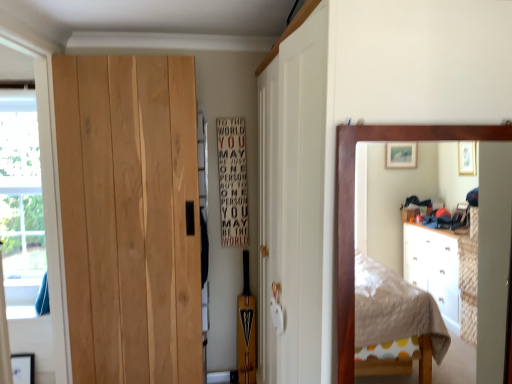
Question: Would you say natural wood door at left is to the left or to the right of transparent plastic window screen at left in the picture?

Choices:
 (A) right
 (B) left

Answer: (A)

Question: Looking at the image, does natural wood door at left seem bigger or smaller compared to transparent plastic window screen at left?

Choices:
 (A) small
 (B) big

Answer: (B)

Question: Which object is positioned closest to the natural wood door at left?

Choices:
 (A) transparent plastic window screen at left
 (B) wooden mirror at right
 (C) white wood sign at center

Answer: (A)

Question: Based on their relative distances, which object is nearer to the wooden mirror at right?

Choices:
 (A) white wood sign at center
 (B) transparent plastic window screen at left
 (C) natural wood door at left

Answer: (C)